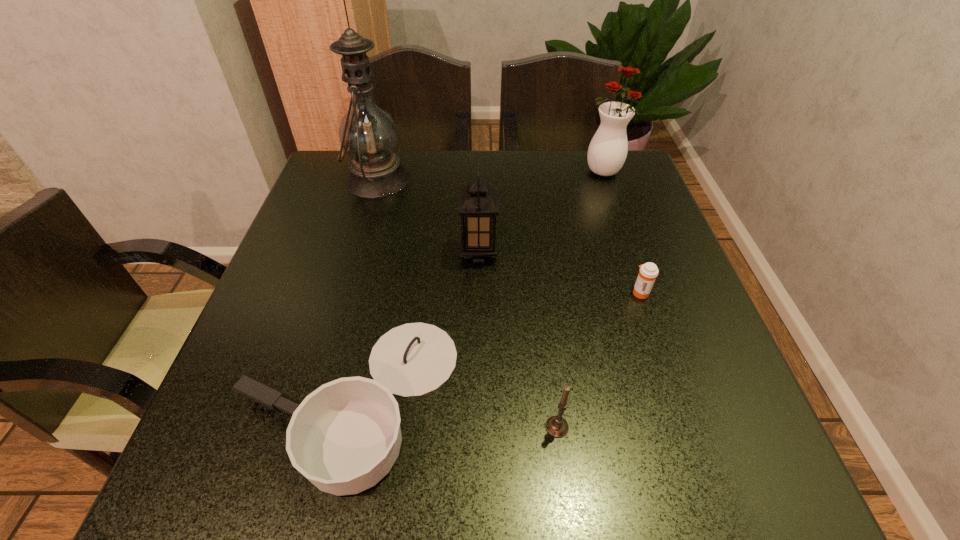
Locate an element on the screen. object at the far left corner is located at coordinates (368, 134).

Locate an element on the screen. object situated at the near left corner is located at coordinates (345, 436).

This screenshot has width=960, height=540. What are the coordinates of `object positioned at the far right corner` in the screenshot? It's located at (607, 152).

Where is `vacant area at the far edge of the desktop`? vacant area at the far edge of the desktop is located at coordinates (445, 172).

In the image, there is a desktop. Where is `vacant space at the near edge`? vacant space at the near edge is located at coordinates [466, 468].

This screenshot has width=960, height=540. Find the location of `free region at the left edge`. free region at the left edge is located at coordinates (293, 351).

You are a GUI agent. You are given a task and a screenshot of the screen. Output one action in this format:
    pyautogui.click(x=<x>, y=<y>)
    Task: Click on the free space at the right edge of the desktop
    This screenshot has height=540, width=960.
    Given the screenshot: What is the action you would take?
    pyautogui.click(x=720, y=387)

In order to click on vacant region at the far right corner of the desktop in this screenshot , I will do `click(584, 164)`.

Locate an element on the screen. This screenshot has height=540, width=960. free region at the near right corner of the desktop is located at coordinates (686, 494).

Locate an element on the screen. blank region between the medicine and the vase is located at coordinates (622, 232).